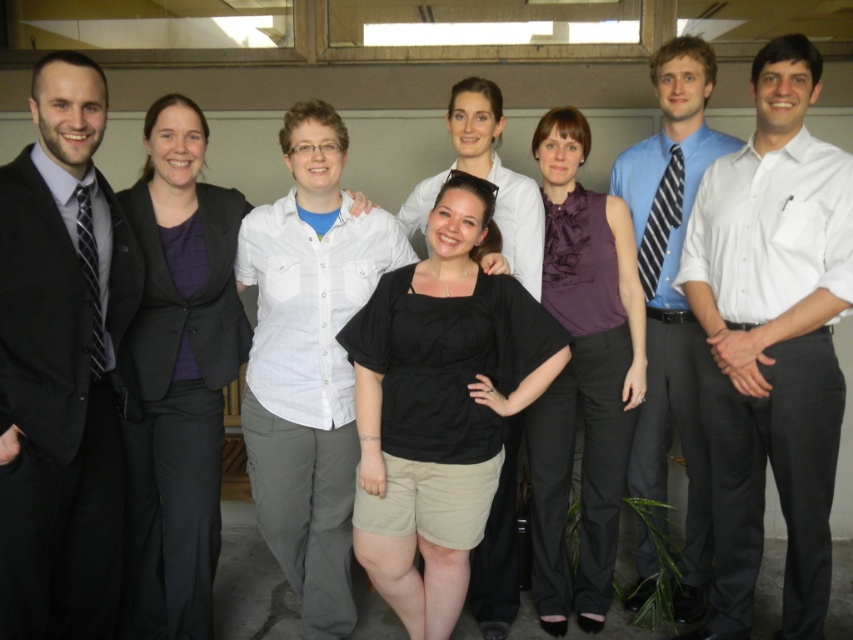
Does point (51, 173) come closer to viewer compared to point (706, 506)?

Yes, point (51, 173) is in front of point (706, 506).

Between black suit at left and blue striped tie at center, which one appears on the right side from the viewer's perspective?

blue striped tie at center

Is point (61, 531) positioned in front of point (641, 424)?

Yes.

Image resolution: width=853 pixels, height=640 pixels. In order to click on black suit at left in this screenshot , I will do `click(61, 365)`.

Is black suit at left bigger than black matte shirt at center?

No.

Is black suit at left below black matte shirt at center?

Indeed, black suit at left is positioned under black matte shirt at center.

Who is more distant from viewer, (48, 147) or (485, 557)?

The point (485, 557) is behind.

What are the coordinates of `black suit at left` in the screenshot? It's located at (61, 365).

Which is below, black suit at left or matte black blazer at left?

matte black blazer at left is below.

What do you see at coordinates (61, 365) in the screenshot? The image size is (853, 640). I see `black suit at left` at bounding box center [61, 365].

In order to click on black suit at left in this screenshot , I will do `click(61, 365)`.